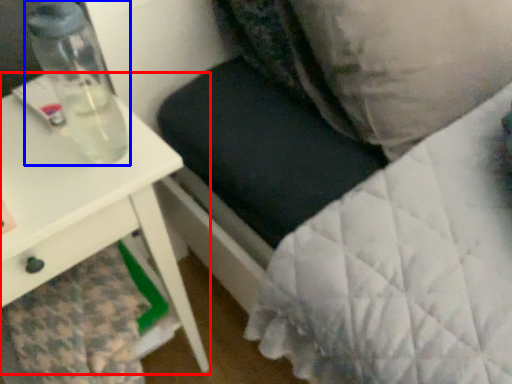
Question: Among these objects, which one is nearest to the camera, table (highlighted by a red box) or bottle (highlighted by a blue box)?

Choices:
 (A) table
 (B) bottle

Answer: (A)